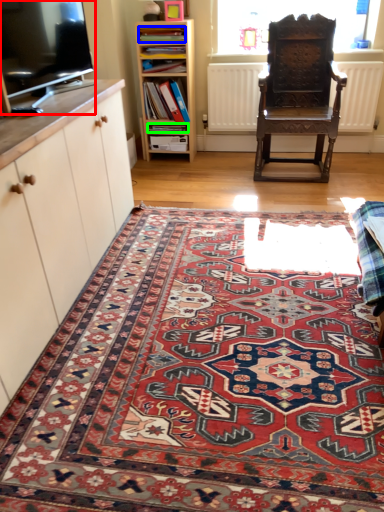
Question: Which is farther away from television (highlighted by a red box)? book (highlighted by a blue box) or book (highlighted by a green box)?

Choices:
 (A) book
 (B) book

Answer: (B)